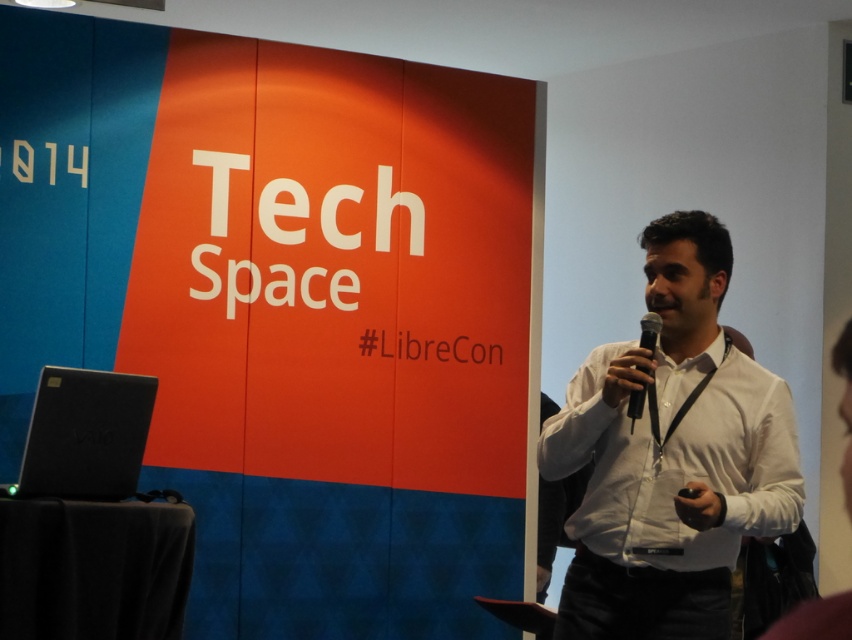
Does point (596, 624) come closer to viewer compared to point (630, 404)?

No, (596, 624) is behind (630, 404).

What do you see at coordinates (671, 456) in the screenshot? I see `white shirt at center` at bounding box center [671, 456].

In order to click on white shirt at center in this screenshot , I will do `click(671, 456)`.